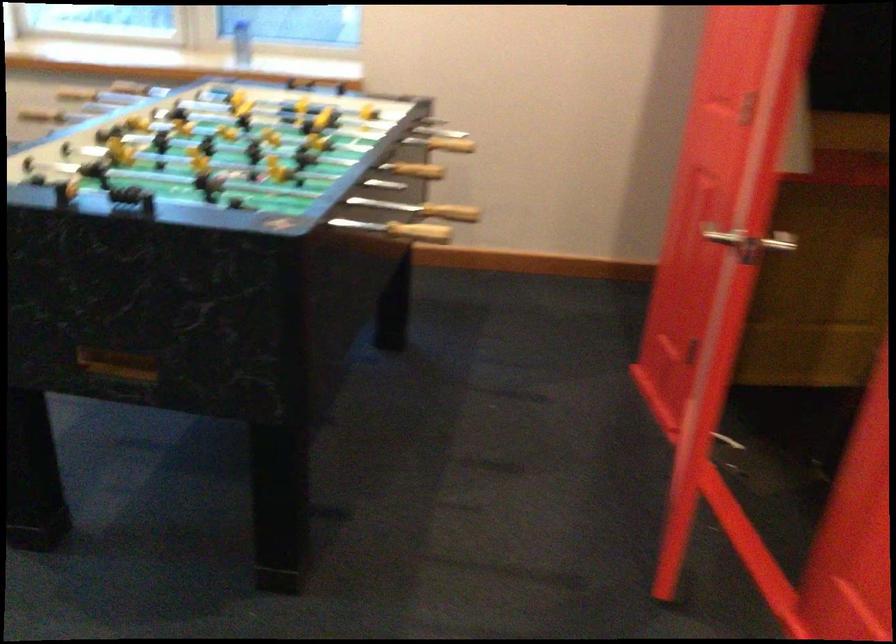
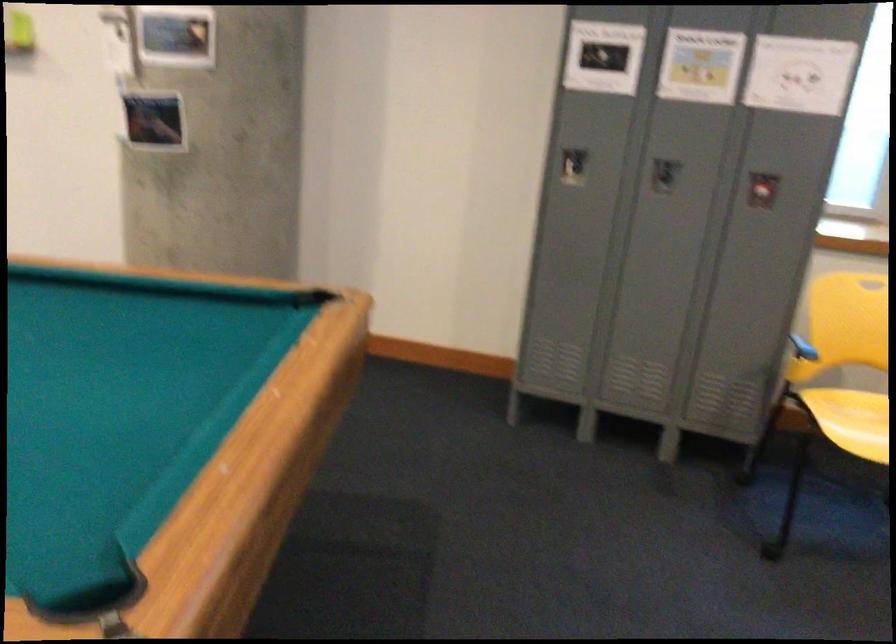
First-person continuous shooting, in which direction is the camera rotating?

The camera's rotation is toward left-down.